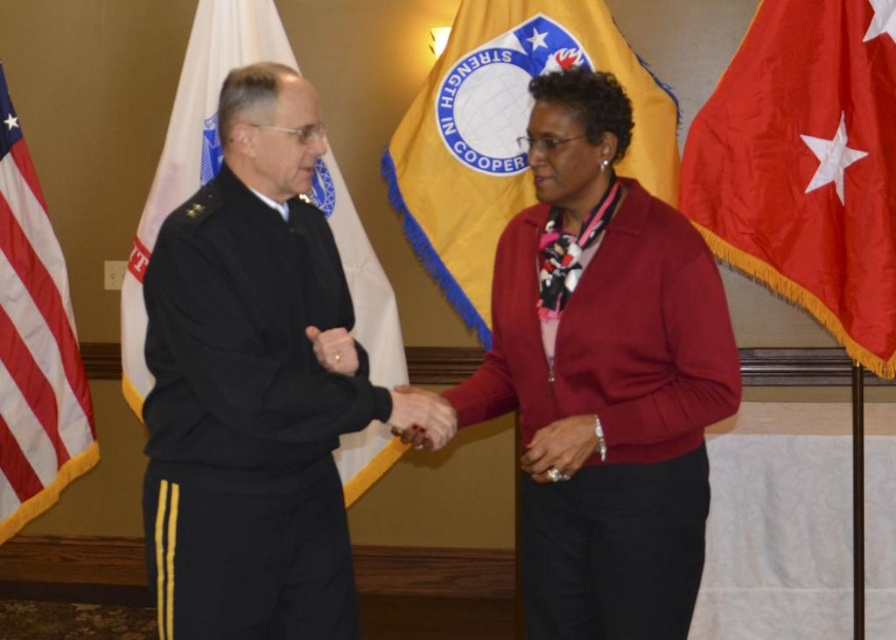
Who is taller, matte red jacket at center or yellow fabric flag at center?

yellow fabric flag at center

Does point (625, 384) lie in front of point (616, 68)?

Yes, point (625, 384) is closer to viewer.

What are the coordinates of `matte red jacket at center` in the screenshot? It's located at (610, 419).

Between point (798, 189) and point (662, 189), which one is positioned in front?

Positioned in front is point (798, 189).

How distant is red fabric flag at right from yellow fabric flag at center?

The distance of red fabric flag at right from yellow fabric flag at center is 19.55 inches.

Who is more distant from viewer, [851,204] or [518,145]?

The point [518,145] is behind.

Find the location of `red fabric flag at right`. red fabric flag at right is located at coordinates (806, 164).

In the scene shown: Can you confirm if white fabric flag at left is positioned below red-white striped flag at left?

No.

Is point (128, 349) behind point (29, 381)?

No, it is not.

This screenshot has width=896, height=640. Describe the element at coordinates (191, 148) in the screenshot. I see `white fabric flag at left` at that location.

This screenshot has height=640, width=896. In order to click on white fabric flag at left in this screenshot , I will do `click(191, 148)`.